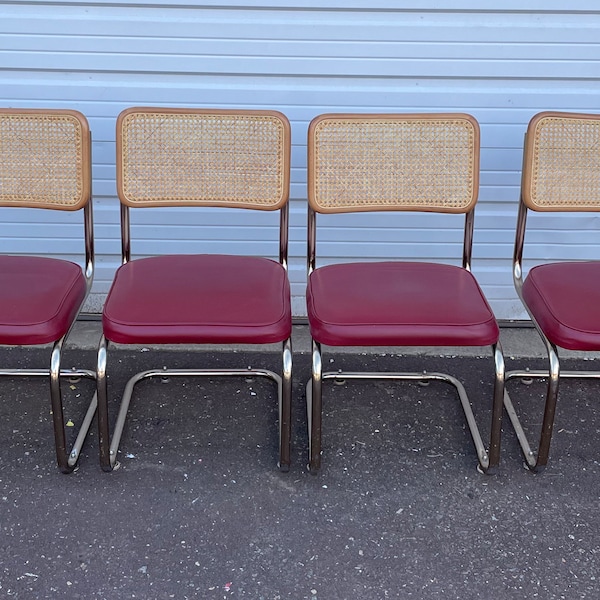
The height and width of the screenshot is (600, 600). Identify the location of cushion. (372, 302).